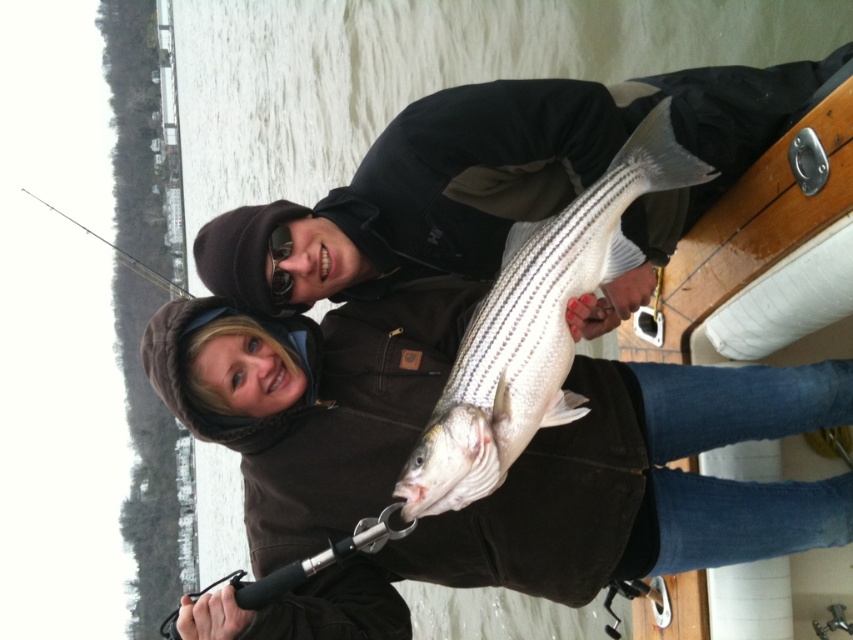
Question: Is white striped fish at center to the right of clear glass fishing pole at left from the viewer's perspective?

Choices:
 (A) no
 (B) yes

Answer: (B)

Question: Which point is closer to the camera taking this photo?

Choices:
 (A) (462, 449)
 (B) (55, 208)

Answer: (A)

Question: Which point is farther to the camera?

Choices:
 (A) (561, 312)
 (B) (125, 253)

Answer: (B)

Question: Is white striped fish at center smaller than clear glass fishing pole at left?

Choices:
 (A) no
 (B) yes

Answer: (B)

Question: Which of the following is the farthest from the observer?

Choices:
 (A) click(x=596, y=218)
 (B) click(x=154, y=275)

Answer: (B)

Question: Does white striped fish at center have a lesser width compared to clear glass fishing pole at left?

Choices:
 (A) no
 (B) yes

Answer: (B)